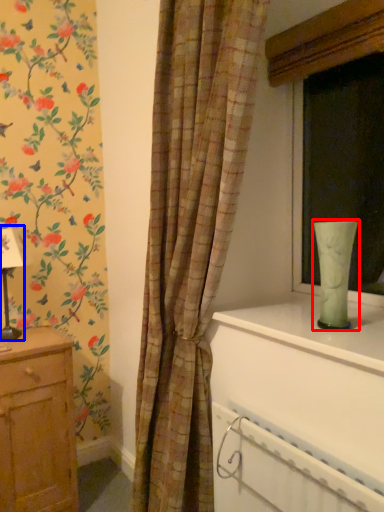
Question: Which of the following is the closest to the observer, glass vase (highlighted by a red box) or table lamp (highlighted by a blue box)?

Choices:
 (A) glass vase
 (B) table lamp

Answer: (A)